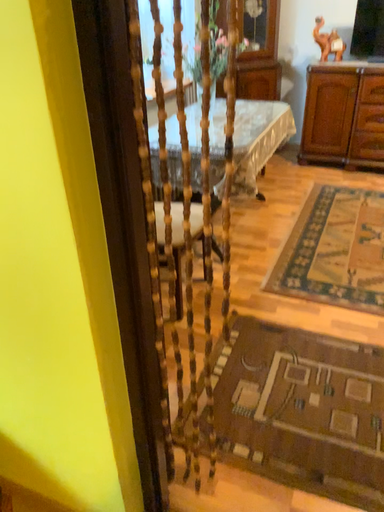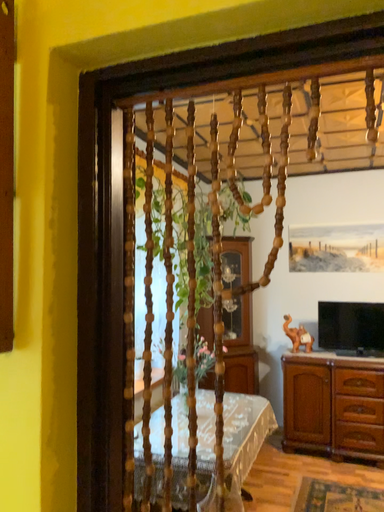
Question: How did the camera likely rotate when shooting the video?

Choices:
 (A) rotated downward
 (B) rotated upward

Answer: (B)